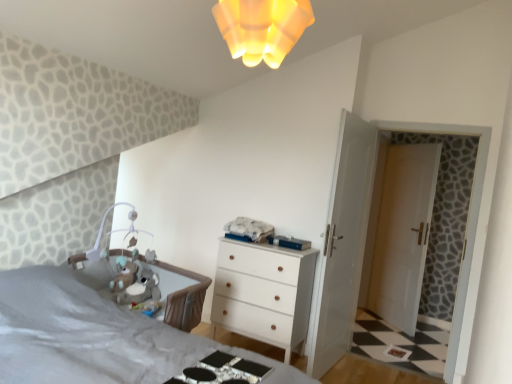
Question: From the image's perspective, would you say yellow frosted glass light fixture at upper center is positioned over white glossy door at center, positioned as the 1th door in left-to-right order?

Choices:
 (A) no
 (B) yes

Answer: (B)

Question: Is the position of yellow frosted glass light fixture at upper center more distant than that of white glossy door at center, which ranks as the first door in front-to-back order?

Choices:
 (A) yes
 (B) no

Answer: (B)

Question: Considering the relative positions of yellow frosted glass light fixture at upper center and white glossy door at center, positioned as the 2th door in back-to-front order, in the image provided, is yellow frosted glass light fixture at upper center in front of white glossy door at center, positioned as the 2th door in back-to-front order,?

Choices:
 (A) yes
 (B) no

Answer: (A)

Question: Considering the relative sizes of yellow frosted glass light fixture at upper center and white glossy door at center, positioned as the 2th door in back-to-front order, in the image provided, is yellow frosted glass light fixture at upper center wider than white glossy door at center, positioned as the 2th door in back-to-front order,?

Choices:
 (A) no
 (B) yes

Answer: (B)

Question: Can you confirm if yellow frosted glass light fixture at upper center is smaller than white glossy door at center, which ranks as the first door in front-to-back order?

Choices:
 (A) no
 (B) yes

Answer: (B)

Question: Can you confirm if yellow frosted glass light fixture at upper center is positioned to the right of white glossy door at center, which ranks as the first door in front-to-back order?

Choices:
 (A) yes
 (B) no

Answer: (B)

Question: Can you confirm if white glossy door at center, which ranks as the first door in front-to-back order, is wider than yellow frosted glass light fixture at upper center?

Choices:
 (A) no
 (B) yes

Answer: (A)

Question: From the image's perspective, is white glossy door at center, positioned as the 1th door in left-to-right order, on yellow frosted glass light fixture at upper center?

Choices:
 (A) no
 (B) yes

Answer: (A)

Question: Does white glossy door at center, positioned as the 1th door in left-to-right order, lie in front of yellow frosted glass light fixture at upper center?

Choices:
 (A) no
 (B) yes

Answer: (A)

Question: Does white glossy door at center, positioned as the 2th door in back-to-front order, have a lesser height compared to yellow frosted glass light fixture at upper center?

Choices:
 (A) yes
 (B) no

Answer: (B)

Question: Does white glossy door at center, which ranks as the first door in front-to-back order, have a smaller size compared to yellow frosted glass light fixture at upper center?

Choices:
 (A) no
 (B) yes

Answer: (A)

Question: Are white glossy door at center, positioned as the 2th door in back-to-front order, and yellow frosted glass light fixture at upper center beside each other?

Choices:
 (A) yes
 (B) no

Answer: (B)

Question: Does metallic silver changing table at lower center have a lesser height compared to white matte chest of drawers at center?

Choices:
 (A) yes
 (B) no

Answer: (A)